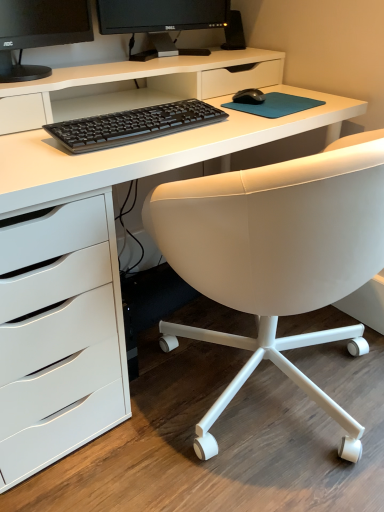
Question: Does black matte mouse at center have a greater width compared to black glossy monitor at upper center?

Choices:
 (A) yes
 (B) no

Answer: (A)

Question: Does black matte mouse at center have a greater height compared to black glossy monitor at upper center?

Choices:
 (A) yes
 (B) no

Answer: (B)

Question: Is black matte mouse at center further to the viewer compared to black glossy monitor at upper center?

Choices:
 (A) yes
 (B) no

Answer: (A)

Question: Is black matte mouse at center outside black glossy monitor at upper center?

Choices:
 (A) no
 (B) yes

Answer: (B)

Question: From a real-world perspective, is black matte mouse at center on top of black glossy monitor at upper center?

Choices:
 (A) yes
 (B) no

Answer: (B)

Question: From the image's perspective, would you say black matte mouse at center is positioned over black glossy monitor at upper center?

Choices:
 (A) no
 (B) yes

Answer: (A)

Question: Does white leather chair at center have a lesser width compared to black glossy monitor at upper center?

Choices:
 (A) yes
 (B) no

Answer: (B)

Question: Is white leather chair at center taller than black glossy monitor at upper center?

Choices:
 (A) no
 (B) yes

Answer: (B)

Question: Is white leather chair at center at the right side of black glossy monitor at upper center?

Choices:
 (A) yes
 (B) no

Answer: (A)

Question: Does white leather chair at center come behind black glossy monitor at upper center?

Choices:
 (A) no
 (B) yes

Answer: (A)

Question: Does white leather chair at center have a smaller size compared to black glossy monitor at upper center?

Choices:
 (A) no
 (B) yes

Answer: (A)

Question: Can you confirm if white leather chair at center is bigger than black glossy monitor at upper center?

Choices:
 (A) no
 (B) yes

Answer: (B)

Question: Considering the relative positions of white leather chair at center and black matte mouse at center in the image provided, is white leather chair at center to the right of black matte mouse at center from the viewer's perspective?

Choices:
 (A) no
 (B) yes

Answer: (B)